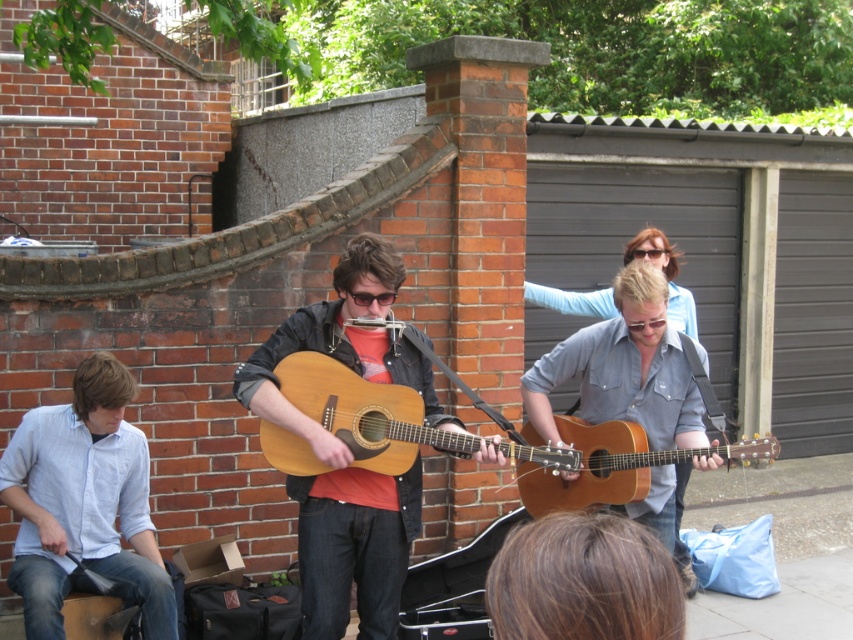
Question: Considering the relative positions of light blue denim shirt at left and light brown acoustic guitar at center in the image provided, where is light blue denim shirt at left located with respect to light brown acoustic guitar at center?

Choices:
 (A) right
 (B) left

Answer: (B)

Question: Is natural wood acoustic guitar at center smaller than clear plastic sunglasses at upper center?

Choices:
 (A) yes
 (B) no

Answer: (B)

Question: Which point appears farthest from the camera in this image?

Choices:
 (A) (529, 621)
 (B) (622, 342)
 (C) (421, 436)
 (D) (635, 250)

Answer: (D)

Question: Which object is farther from the camera taking this photo?

Choices:
 (A) brown hair at lower center
 (B) wooden acoustic guitar at center
 (C) natural wood acoustic guitar at center

Answer: (C)

Question: Can you confirm if matte brown guitar at center is thinner than brown hair at lower center?

Choices:
 (A) no
 (B) yes

Answer: (A)

Question: Which point is closer to the camera?

Choices:
 (A) brown hair at lower center
 (B) clear plastic sunglasses at upper center
 (C) light brown acoustic guitar at center
 (D) matte black sunglasses at center

Answer: (A)